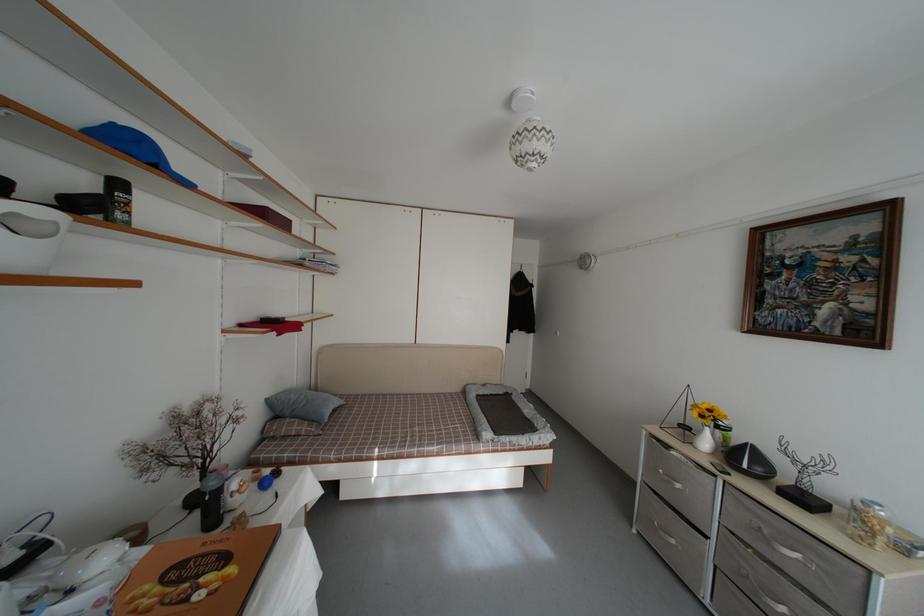
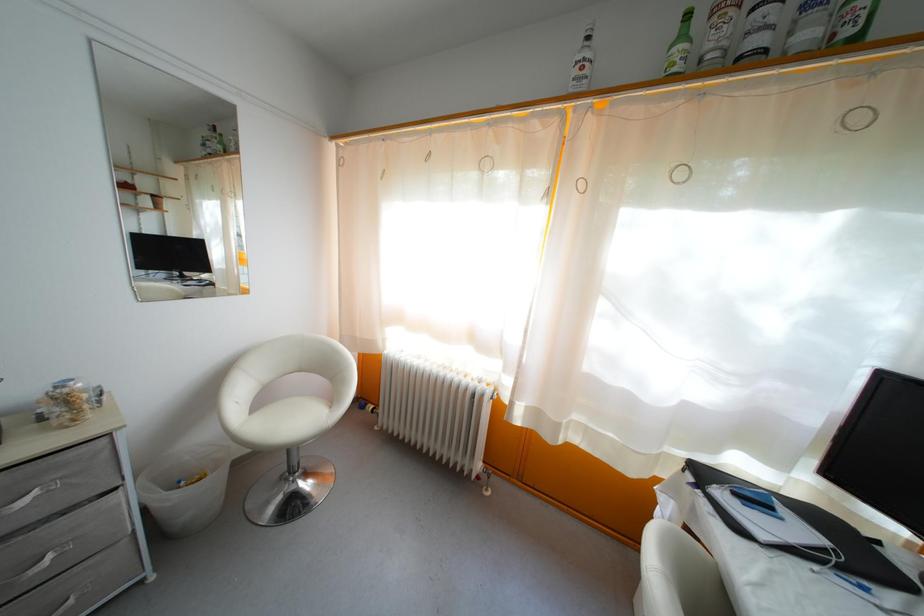
Question: I am providing you with two images of the same scene from different viewpoints. Please identify which objects are invisible in image2.

Choices:
 (A) white trash can
 (B) radiator valve
 (C) white chair sitting surface
 (D) none of these

Answer: (D)